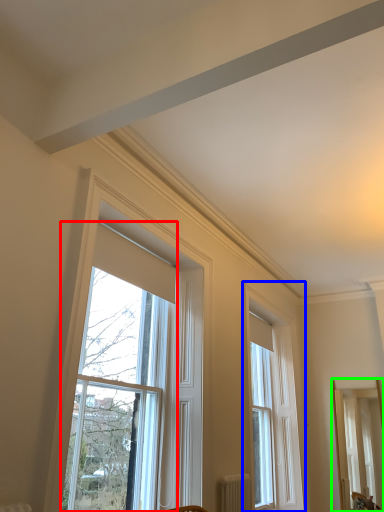
Question: Which object is the farthest from window (highlighted by a red box)? Choose among these: window (highlighted by a blue box) or mirror (highlighted by a green box).

Choices:
 (A) window
 (B) mirror

Answer: (B)